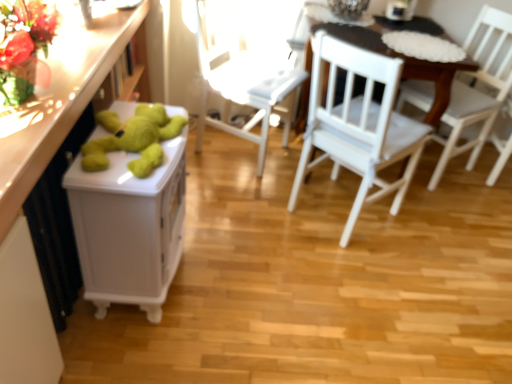
Question: Is white wooden table at center oriented away from green plush bear at left?

Choices:
 (A) yes
 (B) no

Answer: (B)

Question: Is white wooden table at center positioned in front of green plush bear at left?

Choices:
 (A) no
 (B) yes

Answer: (A)

Question: Is the surface of white wooden table at center in direct contact with green plush bear at left?

Choices:
 (A) yes
 (B) no

Answer: (B)

Question: Is white wooden table at center thinner than green plush bear at left?

Choices:
 (A) no
 (B) yes

Answer: (A)

Question: From the image's perspective, is white wooden table at center below green plush bear at left?

Choices:
 (A) yes
 (B) no

Answer: (B)

Question: Is white wooden table at center behind green plush bear at left?

Choices:
 (A) yes
 (B) no

Answer: (A)

Question: Does white wood chair at right, which is counted as the first chair, starting from the right, have a lesser width compared to green plush bear at left?

Choices:
 (A) no
 (B) yes

Answer: (A)

Question: From a real-world perspective, does white wood chair at right, which is counted as the first chair, starting from the right, sit lower than green plush bear at left?

Choices:
 (A) yes
 (B) no

Answer: (B)

Question: Considering the relative positions of white wood chair at right, which is the third chair from left to right, and green plush bear at left in the image provided, is white wood chair at right, which is the third chair from left to right, behind green plush bear at left?

Choices:
 (A) yes
 (B) no

Answer: (A)

Question: Considering the relative positions of white wood chair at right, which is counted as the first chair, starting from the right, and green plush bear at left in the image provided, is white wood chair at right, which is counted as the first chair, starting from the right, to the right of green plush bear at left from the viewer's perspective?

Choices:
 (A) no
 (B) yes

Answer: (B)

Question: Is white wood chair at right, which is the third chair from left to right, shorter than green plush bear at left?

Choices:
 (A) no
 (B) yes

Answer: (A)

Question: From the image's perspective, would you say white wood chair at right, which is the third chair from left to right, is shown under green plush bear at left?

Choices:
 (A) no
 (B) yes

Answer: (A)

Question: Are white wood chair at right, which is counted as the first chair, starting from the right, and green plush bear at left far apart?

Choices:
 (A) yes
 (B) no

Answer: (A)